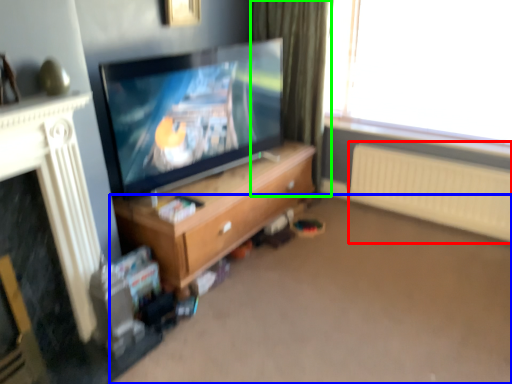
Question: Which object is the closest to the radiator (highlighted by a red box)? Choose among these: plain (highlighted by a blue box) or curtain (highlighted by a green box).

Choices:
 (A) plain
 (B) curtain

Answer: (A)